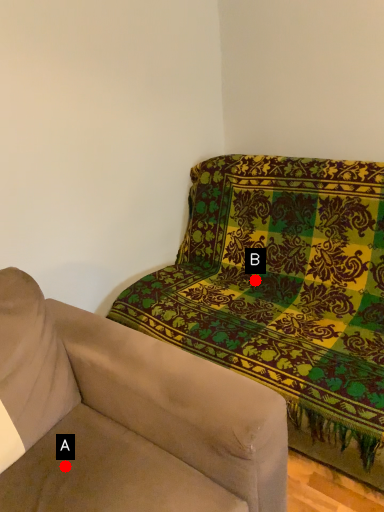
Question: Two points are circled on the image, labeled by A and B beside each circle. Which point is farther from the camera taking this photo?

Choices:
 (A) A is further
 (B) B is further

Answer: (B)